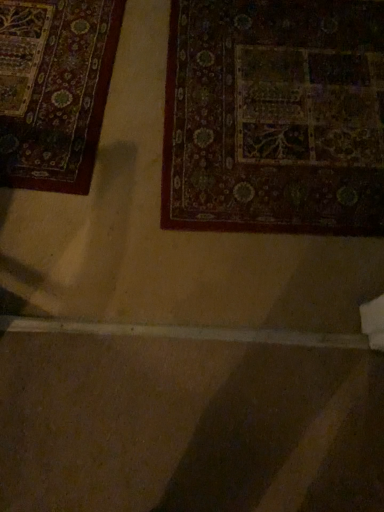
You are a GUI agent. You are given a task and a screenshot of the screen. Output one action in this format:
    pyautogui.click(x=<x>, y=<y>)
    Task: Click on the velvet-like dark brown carpet at upper right
    
    Given the screenshot: What is the action you would take?
    pyautogui.click(x=275, y=116)

Describe the element at coordinates (275, 116) in the screenshot. Image resolution: width=384 pixels, height=512 pixels. I see `velvet-like dark brown carpet at upper right` at that location.

Find the location of a particular element. velvet-like dark brown carpet at upper right is located at coordinates pos(275,116).